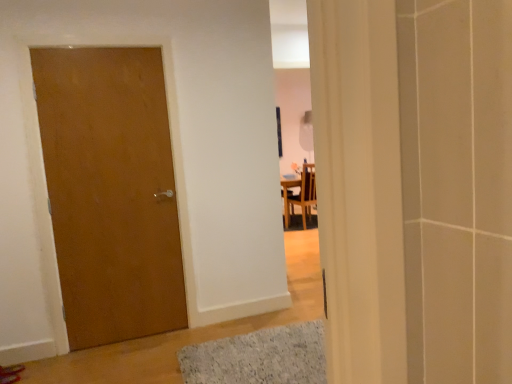
This screenshot has width=512, height=384. I want to click on vacant space in front of matte wood door at left, so click(124, 358).